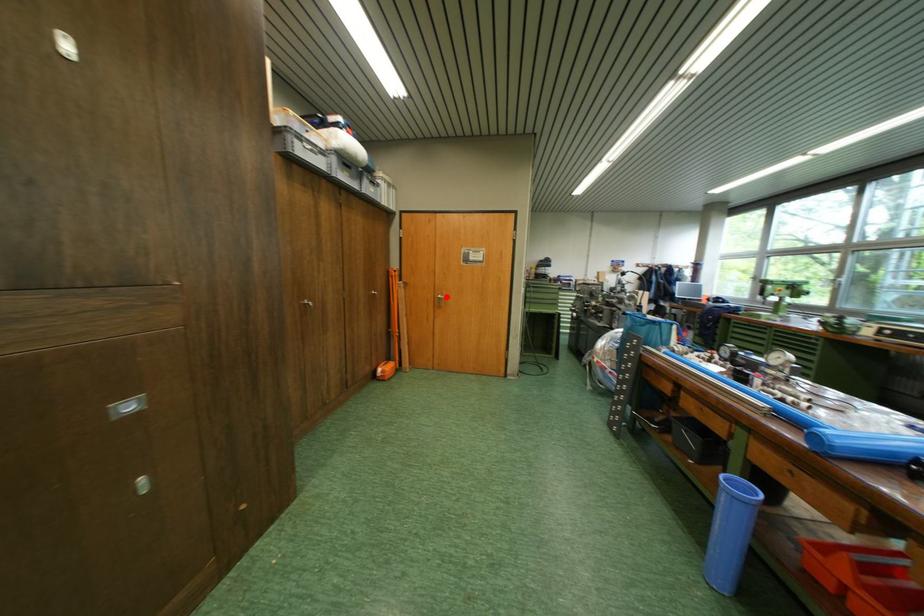
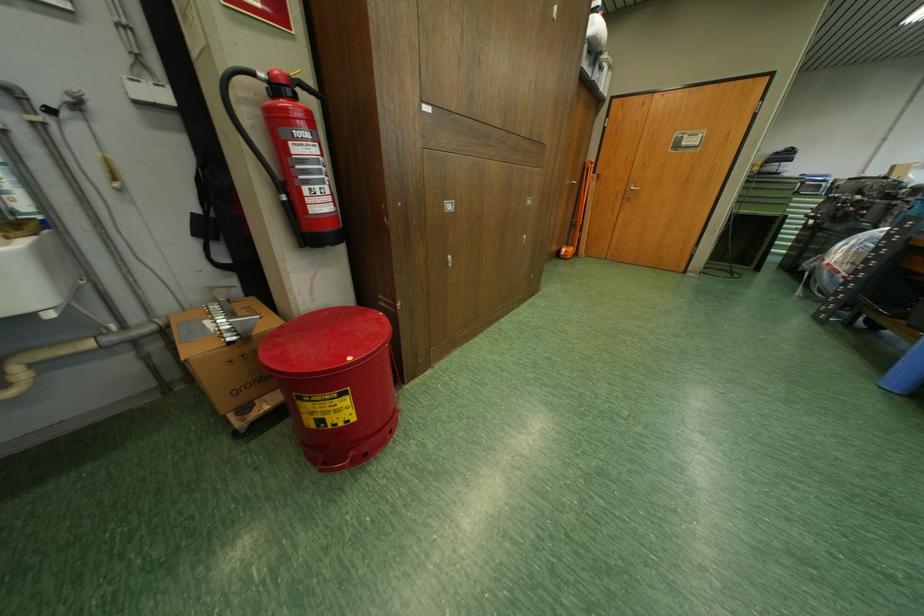
Question: I am providing you with two images of the same scene from different viewpoints. Image1 has a red point marked. In image2, the corresponding 3D location appears at what relative position? Reply with the corresponding letter.

Choices:
 (A) Closer
 (B) Farther

Answer: (A)